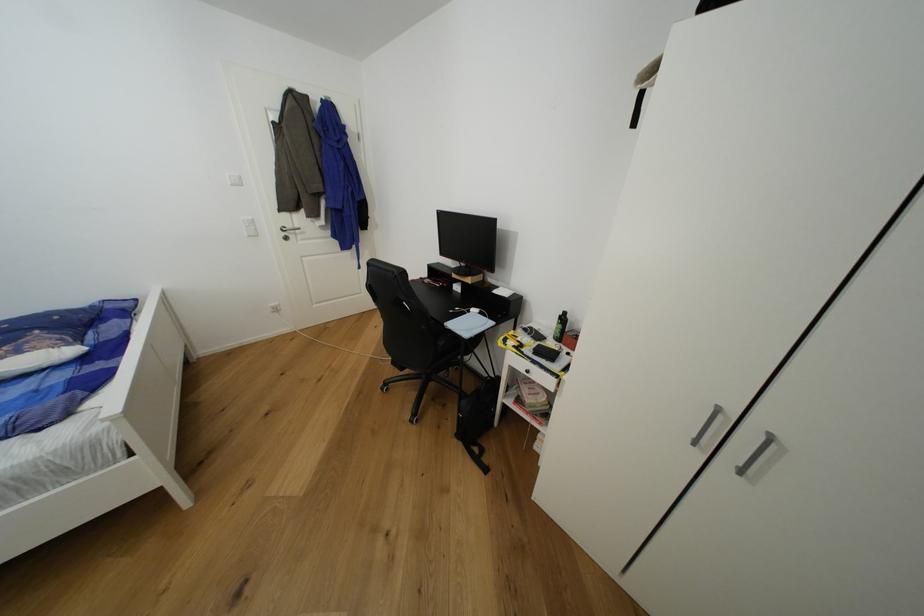
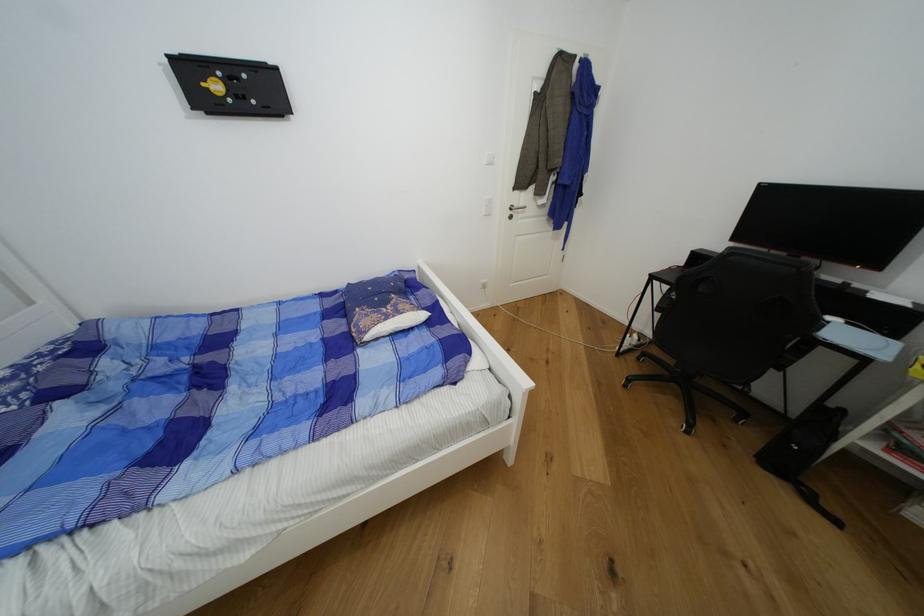
In the second image, find the point that corresponds to pixel 295 228 in the first image.

(521, 207)